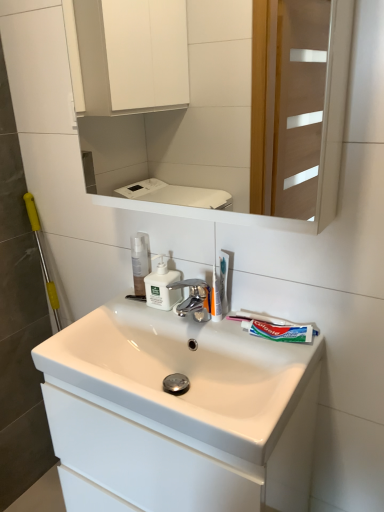
Find the location of a particular element. The image size is (384, 512). free space in front of white matte toothpaste at right is located at coordinates (284, 364).